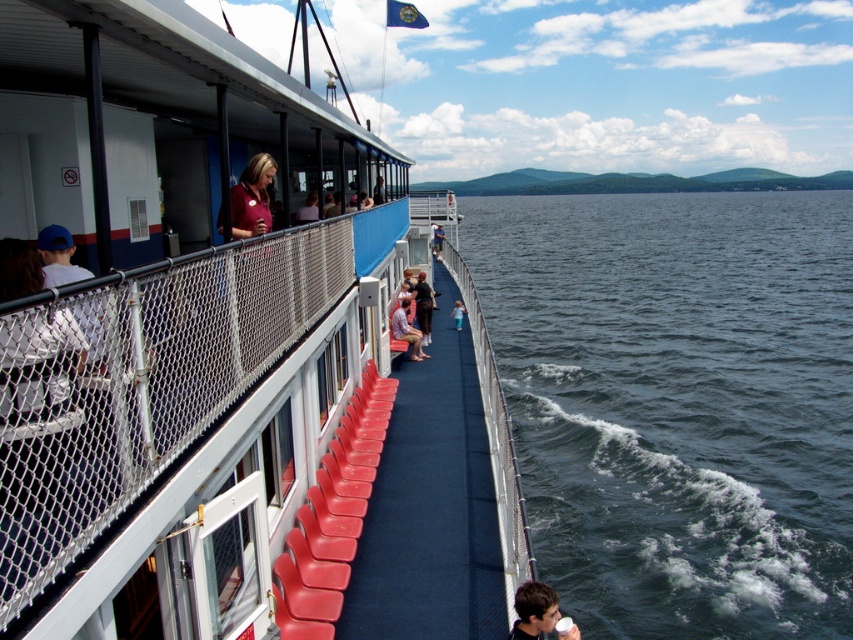
Can you confirm if dark blue water at lower right is positioned to the right of matte pink shirt at center?

Correct, you'll find dark blue water at lower right to the right of matte pink shirt at center.

At what (x,y) coordinates should I click in order to perform the action: click on dark blue water at lower right. Please return your answer as a coordinate pair (x, y). This screenshot has width=853, height=640. Looking at the image, I should click on (677, 403).

Between point (630, 314) and point (418, 333), which one is positioned in front?

Point (418, 333) is in front.

Where is `dark blue water at lower right`? This screenshot has height=640, width=853. dark blue water at lower right is located at coordinates (677, 403).

Does matte red seats at center lie in front of dark blue water at lower right?

Yes, it is in front of dark blue water at lower right.

Who is higher up, matte red seats at center or dark blue water at lower right?

dark blue water at lower right is above.

Is point (491, 440) less distant than point (640, 444)?

Yes, point (491, 440) is in front of point (640, 444).

The image size is (853, 640). I want to click on matte red seats at center, so click(225, 394).

Between point (642, 620) and point (548, 627), which one is positioned behind?

Point (642, 620)

Is dark blue water at lower right bigger than matte black shirt at lower right?

Indeed, dark blue water at lower right has a larger size compared to matte black shirt at lower right.

Describe the element at coordinates (677, 403) in the screenshot. I see `dark blue water at lower right` at that location.

At what (x,y) coordinates should I click in order to perform the action: click on dark blue water at lower right. Please return your answer as a coordinate pair (x, y). Looking at the image, I should click on (677, 403).